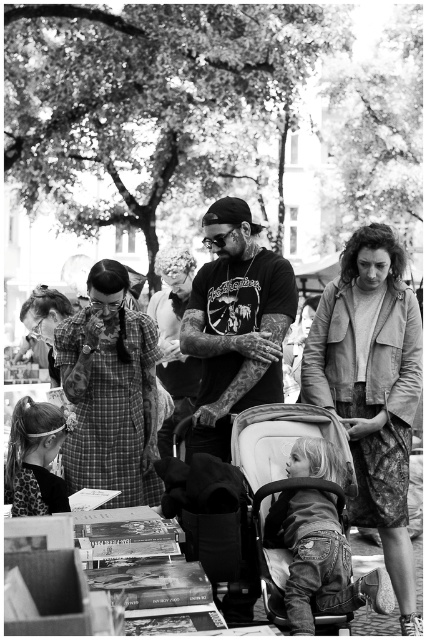
You are a photographer standing at the edge of the market scene. You want to take a photo of the white fabric baby carriage at lower center without the leather jacket at center blocking the view. Is this possible?

The leather jacket at center is further to the viewer than the white fabric baby carriage at lower center, so moving the camera position slightly backward or adjusting the angle might allow capturing the baby carriage without obstruction.

You are a photographer standing at the edge of the market. You notice two subjects in the scene, the dark skin tattooed man at center and the tattooed skin at center. Which one is positioned lower in the image?

The dark skin tattooed man at center is positioned lower in the image than the tattooed skin at center.